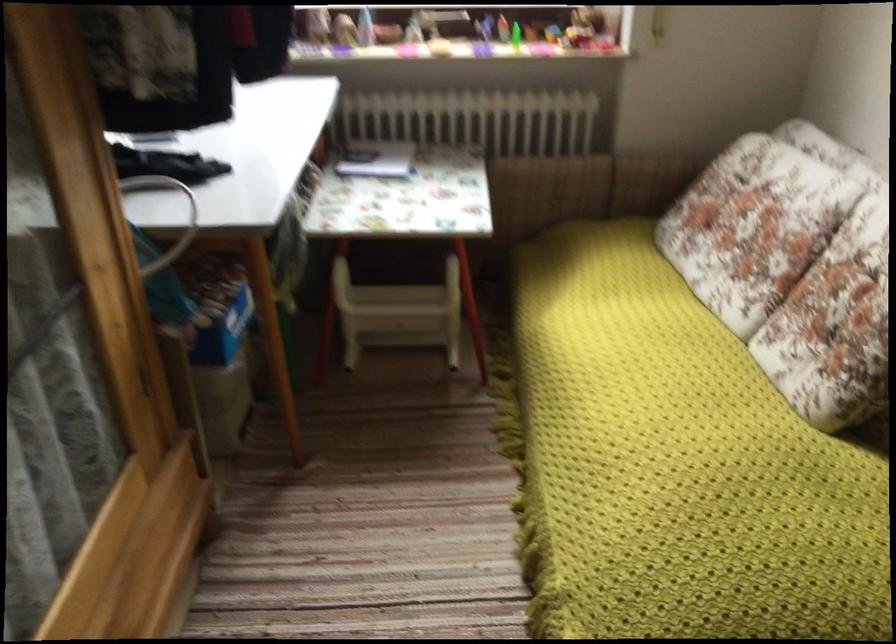
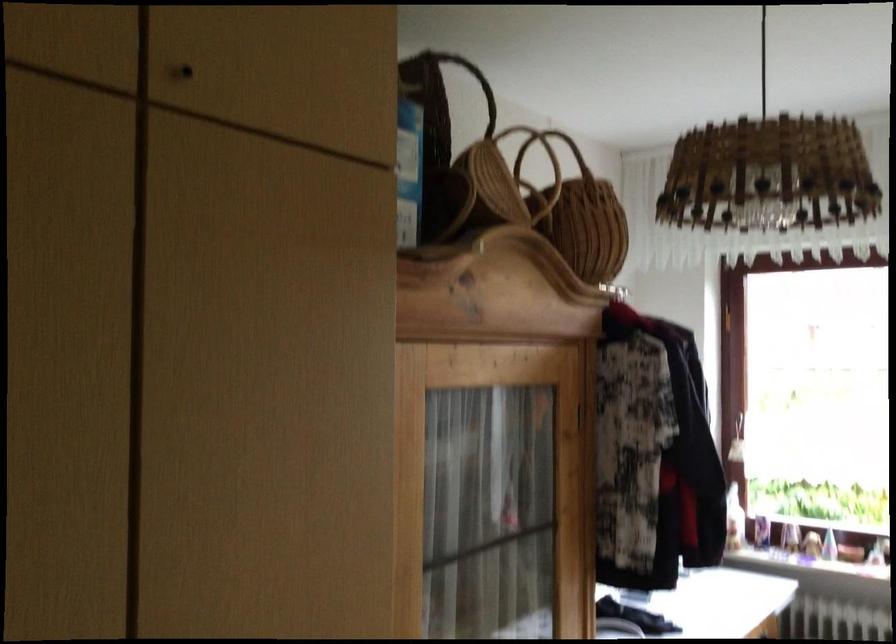
First-person continuous shooting, in which direction is the camera rotating?

The rotation direction of the camera is left-up.